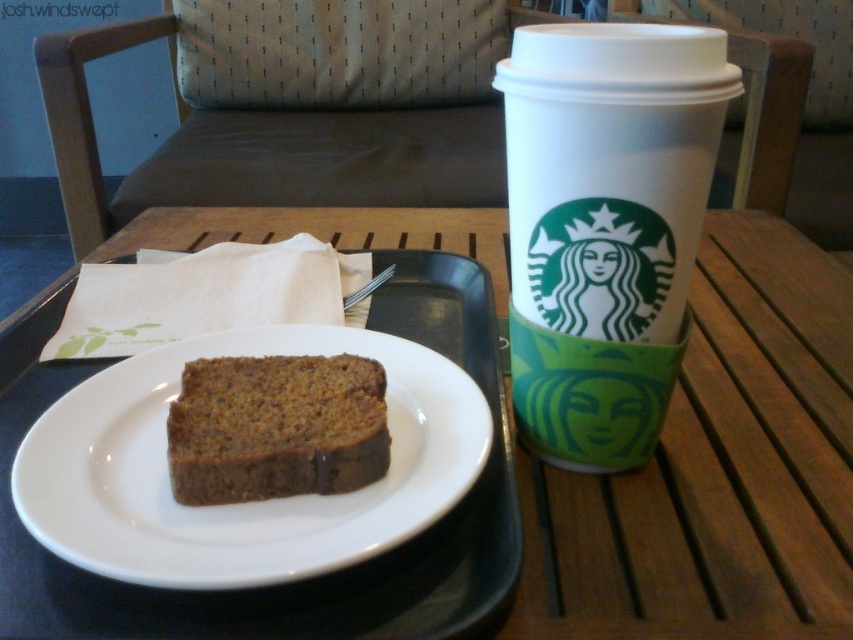
The image size is (853, 640). What do you see at coordinates (717, 468) in the screenshot?
I see `wooden table at center` at bounding box center [717, 468].

This screenshot has height=640, width=853. What are the coordinates of `wooden table at center` in the screenshot? It's located at (717, 468).

Who is lower down, white ceramic plate at center or chocolatesmoothcake at center?

white ceramic plate at center

Who is positioned more to the right, white ceramic plate at center or chocolatesmoothcake at center?

From the viewer's perspective, chocolatesmoothcake at center appears more on the right side.

This screenshot has width=853, height=640. What are the coordinates of `white ceramic plate at center` in the screenshot? It's located at (247, 502).

Between point (584, 394) and point (154, 403), which one is positioned behind?

The point (154, 403) is more distant.

Can you confirm if white paper cup at upper right is thinner than white ceramic plate at center?

Correct, white paper cup at upper right's width is less than white ceramic plate at center's.

Which is behind, point (624, 67) or point (442, 401)?

Point (442, 401)

Locate an element on the screen. The height and width of the screenshot is (640, 853). white paper cup at upper right is located at coordinates (605, 225).